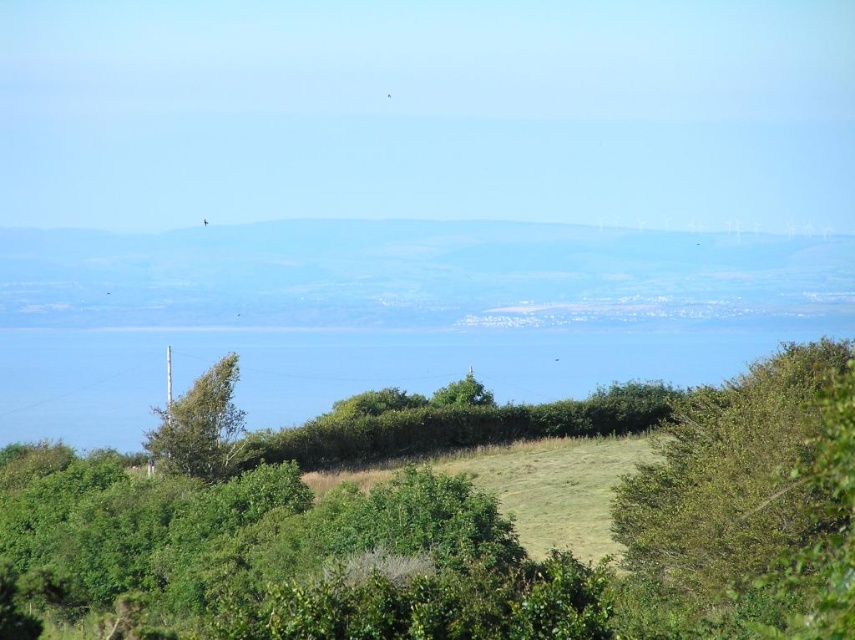
You are standing in the middle of the scene and want to move towards the green leafy tree at lower left. Which direction should you walk to avoid the green leafy bush at lower right?

To avoid the green leafy bush at lower right, you should walk towards the green leafy tree at lower left by moving to the left side, as the bush is positioned to your right and is larger in size compared to the tree.

You are planning to set up a picnic area and need to choose between the green grassy hill at center and the green leafy bush at lower right. Which location offers more space for spreading out a picnic blanket?

The green grassy hill at center might be wider than the green leafy bush at lower right, so it likely provides more space for spreading out a picnic blanket.

You are planning to place a picnic blanket on the green grassy hill at center and the green leafy tree at lower left. Which location would provide more space for the blanket?

The green grassy hill at center is larger in size than the green leafy tree at lower left, so placing the picnic blanket on the green grassy hill at center would provide more space.